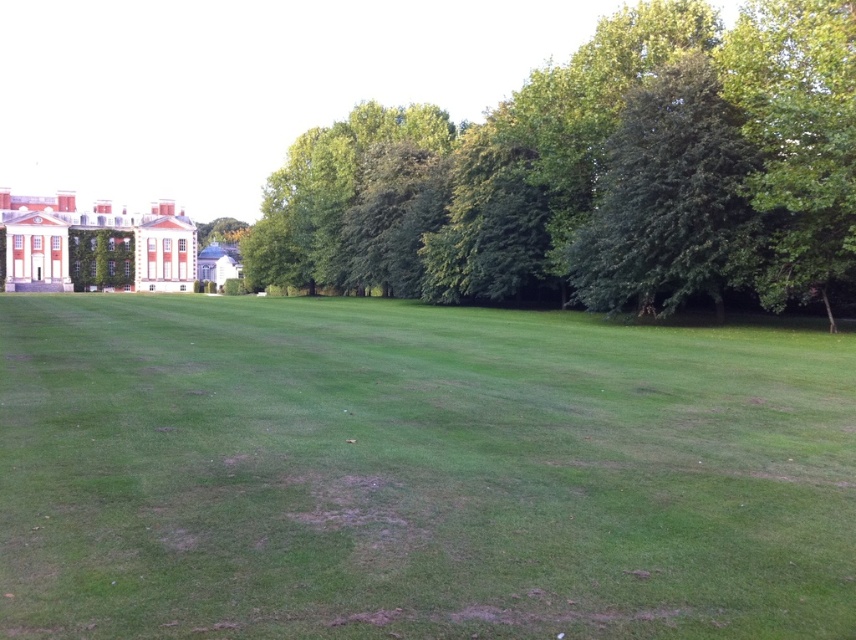
Who is positioned more to the left, green leafy tree at center or green ivy-covered wall at left?

From the viewer's perspective, green ivy-covered wall at left appears more on the left side.

Who is taller, green leafy tree at center or green ivy-covered wall at left?

With more height is green leafy tree at center.

Between point (663, 92) and point (70, 269), which one is positioned in front?

Point (663, 92) is in front.

Image resolution: width=856 pixels, height=640 pixels. In order to click on green leafy tree at center in this screenshot , I will do `click(597, 176)`.

Between green grassy field at center and green leafy tree at center, which one is positioned higher?

green leafy tree at center is above.

The width and height of the screenshot is (856, 640). Find the location of `green grassy field at center`. green grassy field at center is located at coordinates (415, 472).

Who is taller, green grassy field at center or green ivy-covered wall at left?

With more height is green ivy-covered wall at left.

Is green grassy field at center taller than green ivy-covered wall at left?

No, green grassy field at center is not taller than green ivy-covered wall at left.

The width and height of the screenshot is (856, 640). Find the location of `green grassy field at center`. green grassy field at center is located at coordinates (415, 472).

You are a GUI agent. You are given a task and a screenshot of the screen. Output one action in this format:
    pyautogui.click(x=<x>, y=<y>)
    Task: Click on the green grassy field at center
    
    Given the screenshot: What is the action you would take?
    pyautogui.click(x=415, y=472)